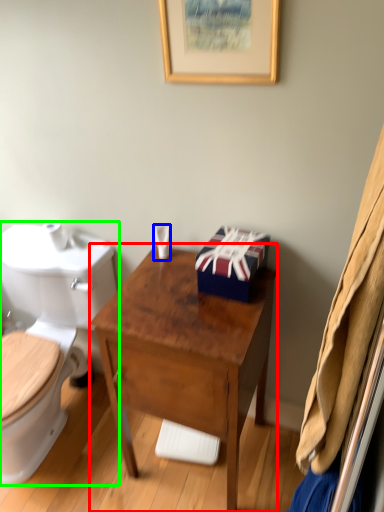
Question: Which is farther away from desk (highlighted by a red box)? toiletries (highlighted by a blue box) or toilet (highlighted by a green box)?

Choices:
 (A) toiletries
 (B) toilet

Answer: (B)